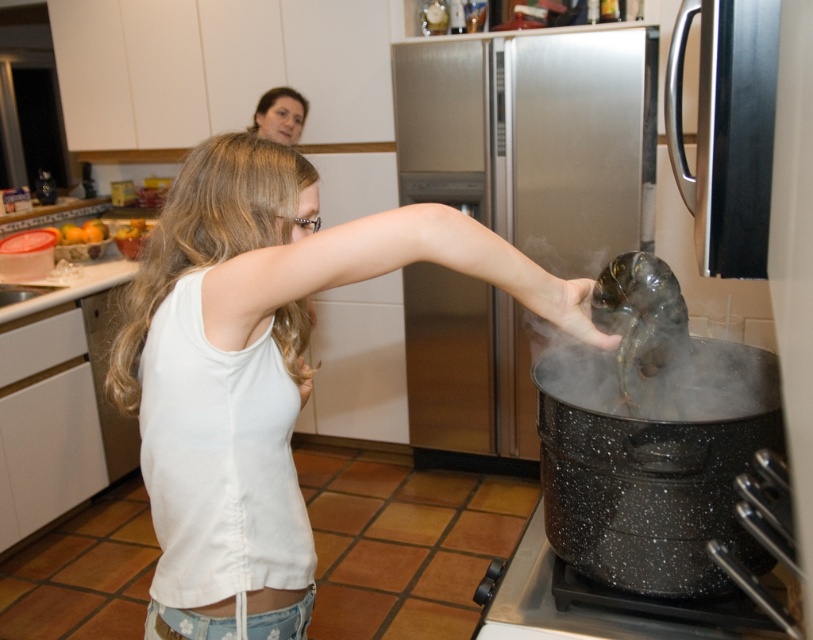
You are a fashion designer looking to create a new line of clothing. You observe the white cotton tank top at center and the stainless steel refrigerator at center in the kitchen scene. Which item is narrower in terms of width?

The white cotton tank top at center has a lesser width compared to the stainless steel refrigerator at center, so the white cotton tank top at center is narrower.

In the scene shown: You are a chef standing in the kitchen and need to place a hot pan on a surface. You see the satin black refrigerator at right and the black speckled pot at lower right. Which object is a better choice for placing the pan to avoid burning the surface?

The satin black refrigerator at right is taller than the black speckled pot at lower right, but neither is suitable for placing a hot pan. The refrigerator surface might be cooler, but it is not designed for this purpose. The pot is already in use. Please use a proper heatproof surface like a trivet or stove area.

You are a delivery person who needs to place a 2 meter long package between the white cotton tank top at center and the stainless steel refrigerator at center. Is there enough space between them to fit the package?

The distance between the white cotton tank top at center and the stainless steel refrigerator at center is 1.95 meters. Since the package is 2 meters long, it is slightly longer than the available space. Therefore, the package cannot be placed between them without overlapping.